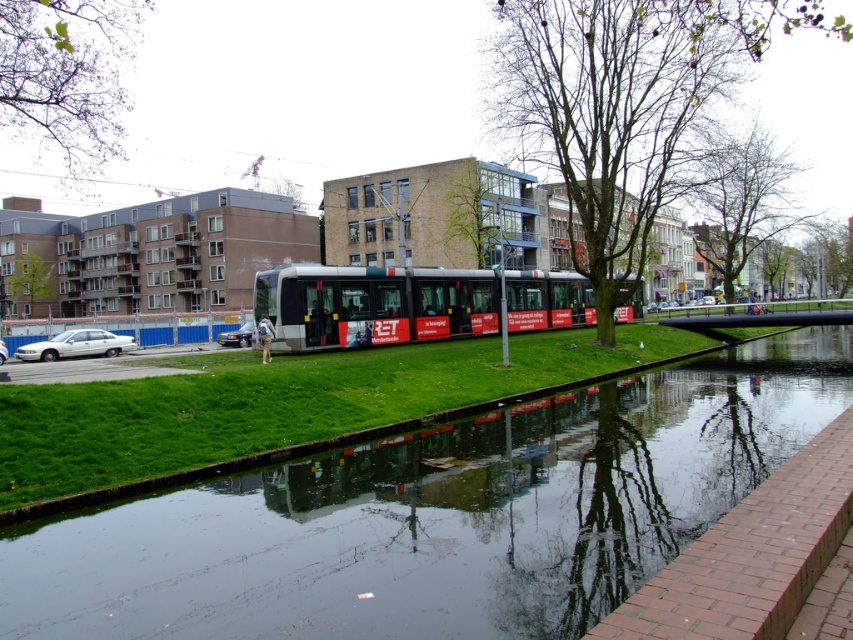
Question: Observing the image, what is the correct spatial positioning of green grass at center in reference to silver metallic bus at center?

Choices:
 (A) below
 (B) above

Answer: (A)

Question: Is green grass at center closer to camera compared to silver metallic bus at center?

Choices:
 (A) yes
 (B) no

Answer: (A)

Question: Is the position of green grass at center more distant than that of silver metallic bus at center?

Choices:
 (A) no
 (B) yes

Answer: (A)

Question: Which point is closer to the camera?

Choices:
 (A) silver metallic bus at center
 (B) green grass at center

Answer: (B)